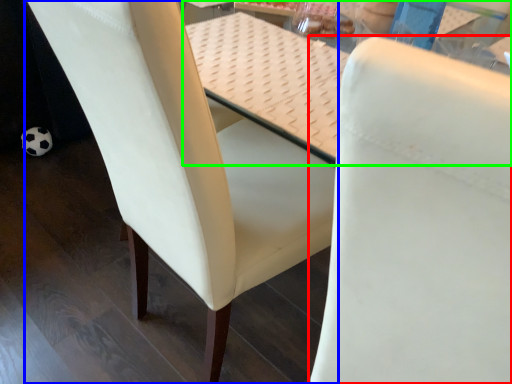
Question: Estimate the real-world distances between objects in this image. Which object is farther from chair (highlighted by a red box), chair (highlighted by a blue box) or table (highlighted by a green box)?

Choices:
 (A) chair
 (B) table

Answer: (B)